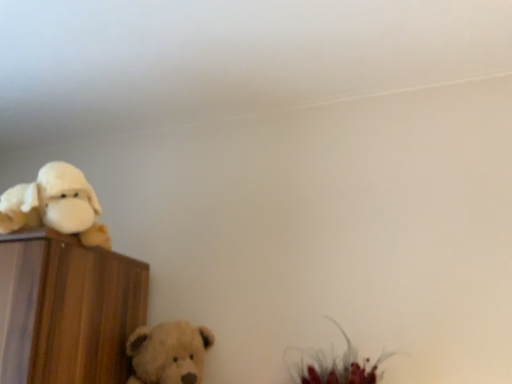
You are a GUI agent. You are given a task and a screenshot of the screen. Output one action in this format:
    pyautogui.click(x=<x>, y=<y>)
    Task: Click on the white plush teddy bear at upper left
    The width and height of the screenshot is (512, 384).
    Given the screenshot: What is the action you would take?
    pyautogui.click(x=55, y=205)

What is the approximate width of white plush teddy bear at upper left?

15.48 inches.

Measure the distance between white plush teddy bear at upper left and camera.

The depth of white plush teddy bear at upper left is 1.03 meters.

This screenshot has width=512, height=384. Describe the element at coordinates (55, 205) in the screenshot. I see `white plush teddy bear at upper left` at that location.

In order to face white plush teddy bear at upper left, should I rotate leftwards or rightwards?

Rotate your view left by about 25.115°.

At what (x,y) coordinates should I click in order to perform the action: click on white plush teddy bear at upper left. Please return your answer as a coordinate pair (x, y). The width and height of the screenshot is (512, 384). Looking at the image, I should click on (55, 205).